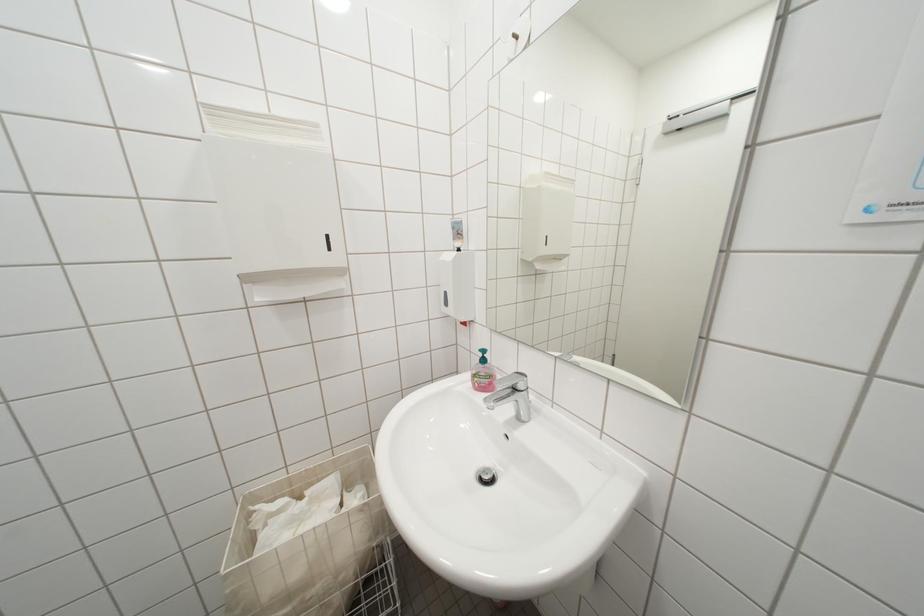
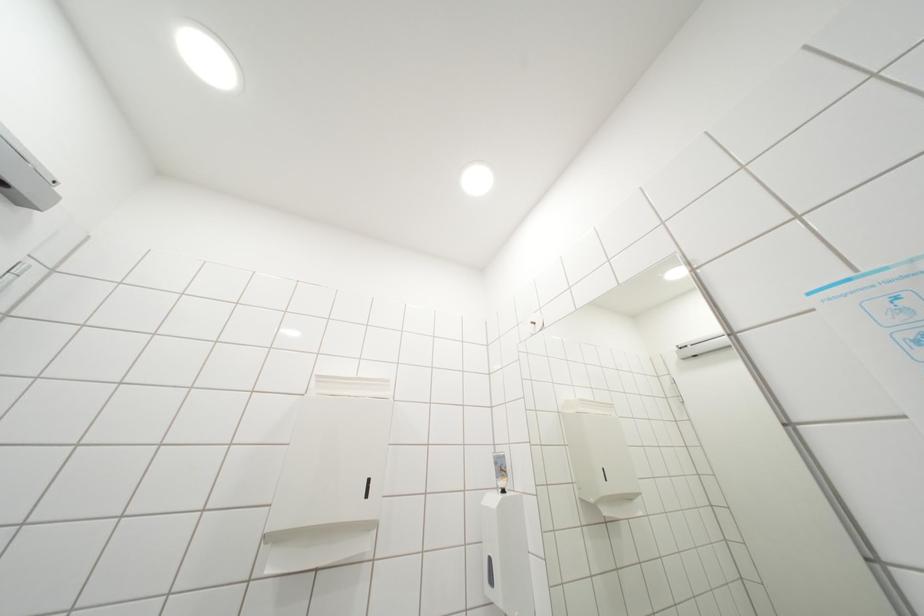
Question: The first image is from the beginning of the video and the second image is from the end. How did the camera likely rotate when shooting the video?

Choices:
 (A) Left
 (B) Right
 (C) Up
 (D) Down

Answer: (C)